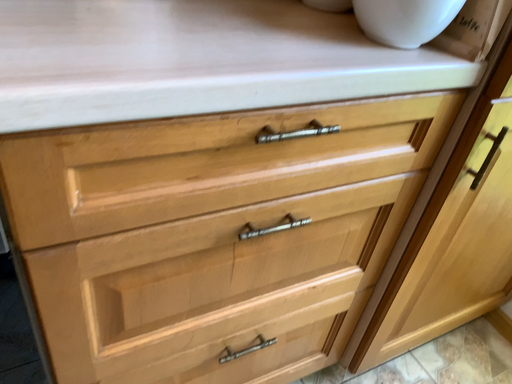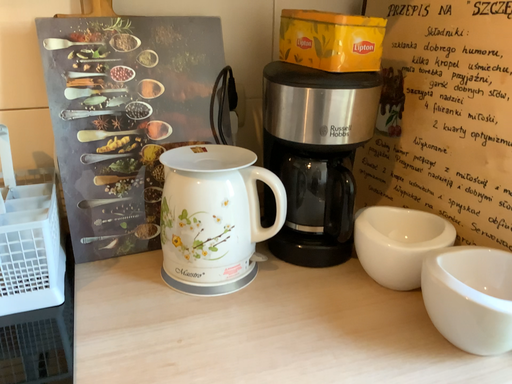
Question: Which way did the camera rotate in the video?

Choices:
 (A) rotated right
 (B) rotated left

Answer: (B)